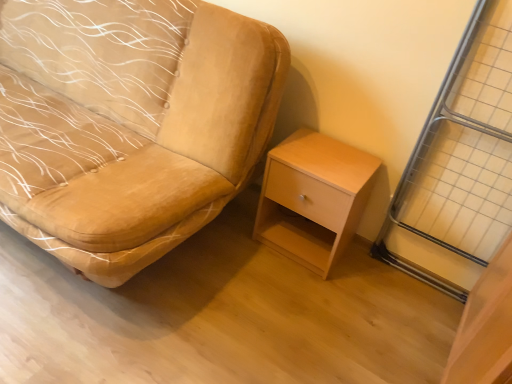
This screenshot has height=384, width=512. Find the location of `vacant space in metallic silver screen door at right (from a real-world perspective)`. vacant space in metallic silver screen door at right (from a real-world perspective) is located at coordinates (414, 280).